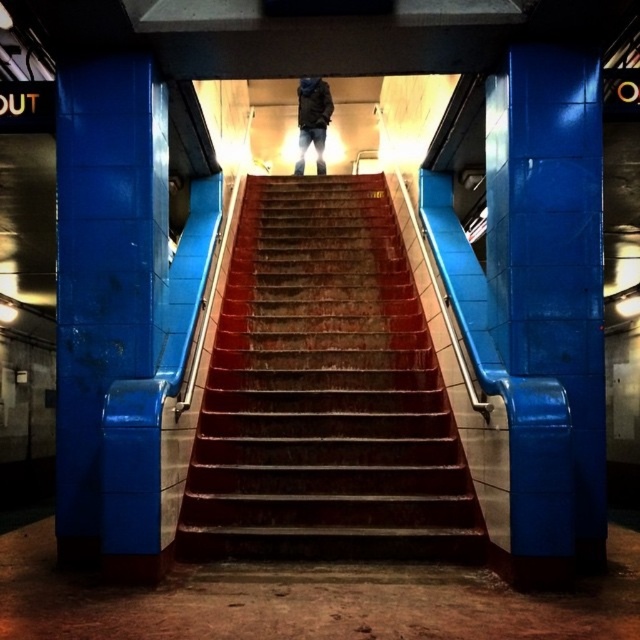
Question: Is rusty metal stairs at center above blue glossy pillar at left?

Choices:
 (A) no
 (B) yes

Answer: (A)

Question: Based on their relative distances, which object is farther from the dark gray jacket at center?

Choices:
 (A) rusty metal stairs at center
 (B) blue glossy pillar at right
 (C) blue glossy pillar at left

Answer: (B)

Question: Considering the relative positions of blue glossy pillar at right and dark gray jacket at center in the image provided, where is blue glossy pillar at right located with respect to dark gray jacket at center?

Choices:
 (A) left
 (B) right

Answer: (B)

Question: Which of these objects is positioned farthest from the rusty metal stairs at center?

Choices:
 (A) blue glossy pillar at right
 (B) dark gray jacket at center

Answer: (B)

Question: Which of the following is the closest to the observer?

Choices:
 (A) blue glossy pillar at right
 (B) dark gray jacket at center
 (C) blue glossy pillar at left

Answer: (A)

Question: Can you confirm if blue glossy pillar at right is positioned to the left of blue glossy pillar at left?

Choices:
 (A) yes
 (B) no

Answer: (B)